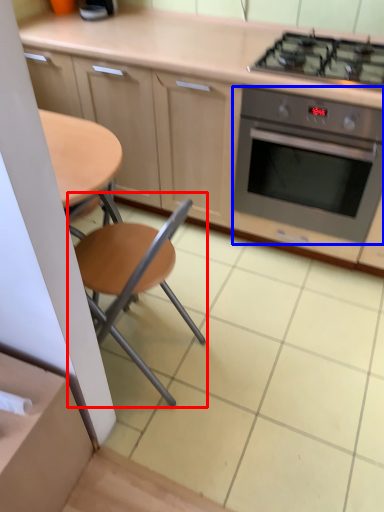
Question: Which object is closer to the camera taking this photo, chair (highlighted by a red box) or kitchen appliance (highlighted by a blue box)?

Choices:
 (A) chair
 (B) kitchen appliance

Answer: (A)